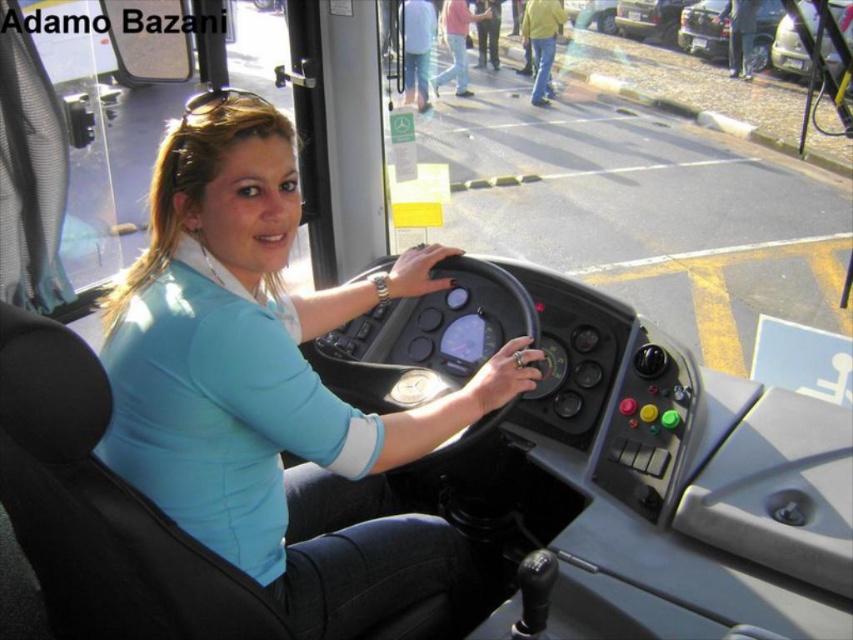
Who is more forward, (376,296) or (677,45)?

Point (376,296)

Is blue fabric shirt at center further to the viewer compared to metallic silver car at upper right?

That is False.

Is point (187, 512) positioned behind point (695, 3)?

No.

The height and width of the screenshot is (640, 853). I want to click on blue fabric shirt at center, so click(274, 387).